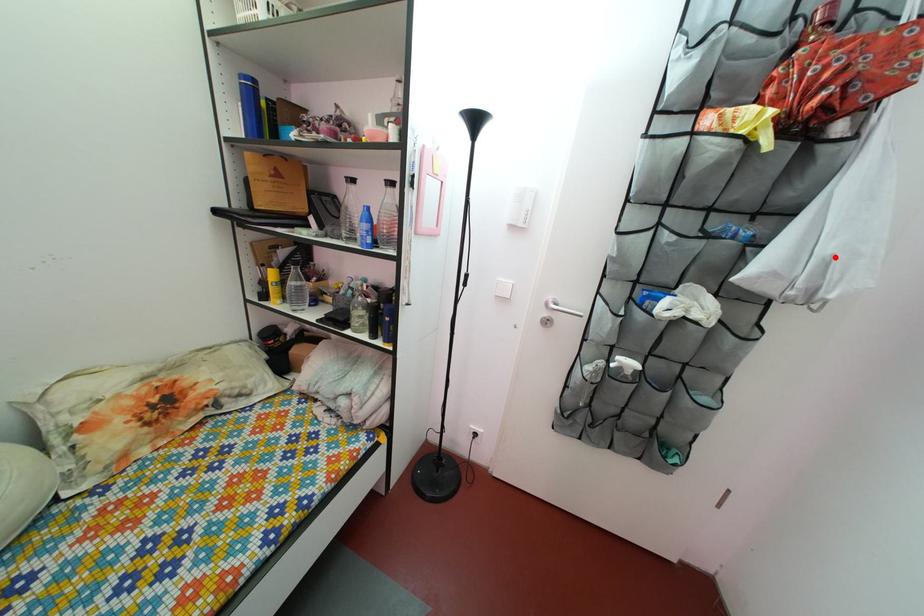
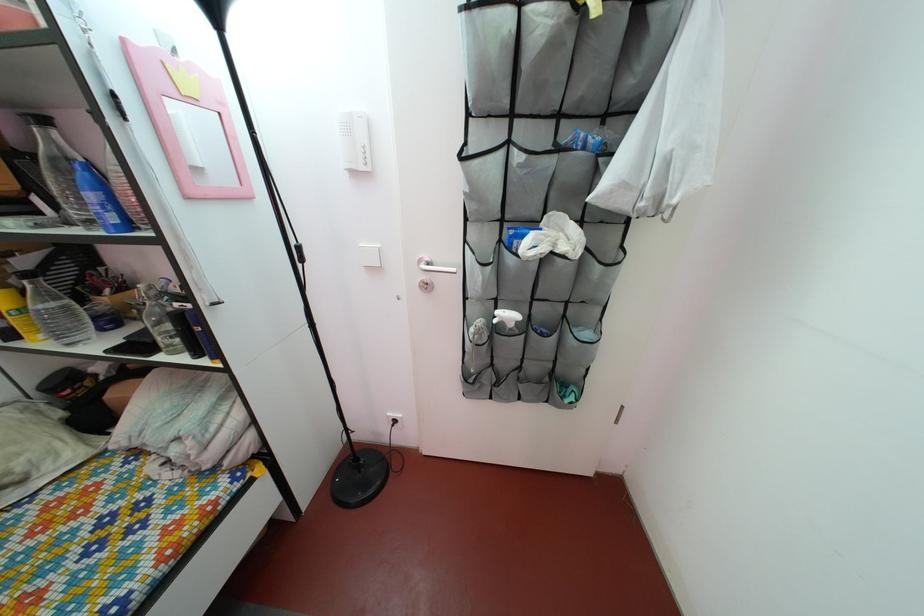
Where in the second image is the point corresponding to the highlighted location from the first image?

(675, 152)